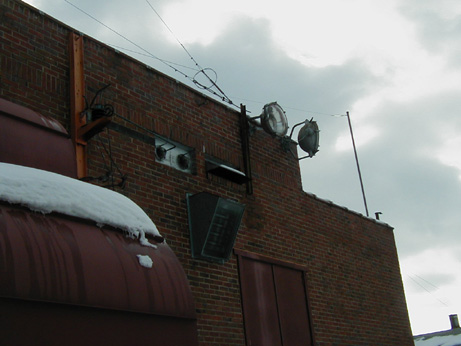
The width and height of the screenshot is (461, 346). I want to click on cabling, so click(x=121, y=176), click(x=108, y=169), click(x=95, y=97).